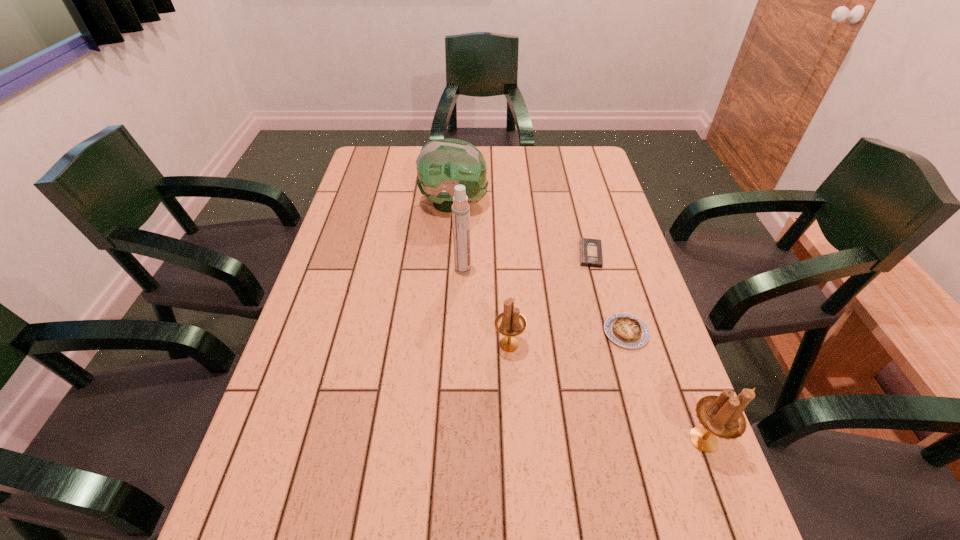
You are a GUI agent. You are given a task and a screenshot of the screen. Output one action in this format:
    pyautogui.click(x=<x>, y=<y>)
    Task: Click on the free space between the videotape and the football helmet
    This screenshot has width=960, height=540.
    Given the screenshot: What is the action you would take?
    pyautogui.click(x=522, y=229)

I want to click on free area in between the tallest object and the shortest object, so click(x=527, y=262).

Find the location of `free point between the second shortest object and the taller candle holder`. free point between the second shortest object and the taller candle holder is located at coordinates (664, 386).

Locate an element on the screen. The width and height of the screenshot is (960, 540). vacant point located between the nearer candle holder and the farthest object is located at coordinates (579, 321).

Locate an element on the screen. This screenshot has width=960, height=540. vacant space in between the tallest object and the quiche is located at coordinates click(x=544, y=301).

Locate which object ranks second in proximity to the videotape. Please provide its 2D coordinates. Your answer should be formatted as a tuple, i.e. [(x, y)], where the tuple contains the x and y coordinates of a point satisfying the conditions above.

[(442, 164)]

You are a GUI agent. You are given a task and a screenshot of the screen. Output one action in this format:
    pyautogui.click(x=<x>, y=<y>)
    Task: Click on the object that is the closest to the nearest object
    
    Given the screenshot: What is the action you would take?
    pyautogui.click(x=626, y=330)

Where is `free region that satisfies the following two spatial constraints: 1. on the visor of the second shortest object; 2. on the right side of the farthest object`? This screenshot has width=960, height=540. free region that satisfies the following two spatial constraints: 1. on the visor of the second shortest object; 2. on the right side of the farthest object is located at coordinates (445, 332).

In order to click on vacant point that satisfies the following two spatial constraints: 1. on the front side of the aerosol can; 2. on the left side of the fifth tallest object in this screenshot , I will do `click(461, 332)`.

Find the location of a particular element. free space that satisfies the following two spatial constraints: 1. on the back side of the videotape; 2. on the visor of the football helmet is located at coordinates pyautogui.click(x=577, y=204).